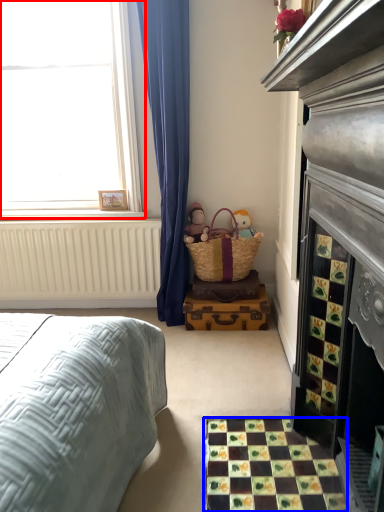
Question: Among these objects, which one is farthest to the camera, window (highlighted by a red box) or tile (highlighted by a blue box)?

Choices:
 (A) window
 (B) tile

Answer: (A)